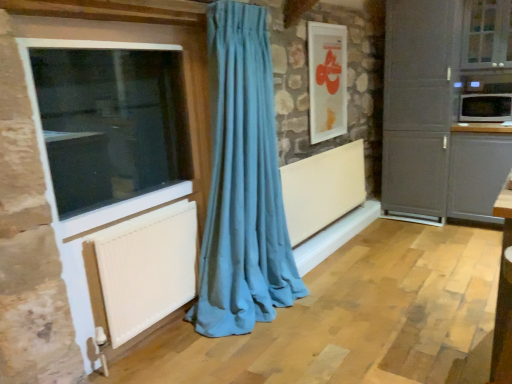
Locate an element on the screen. This screenshot has height=384, width=512. vacant region in front of matte gray cabinet at right, which is the 2th cabinetry from left to right is located at coordinates (476, 239).